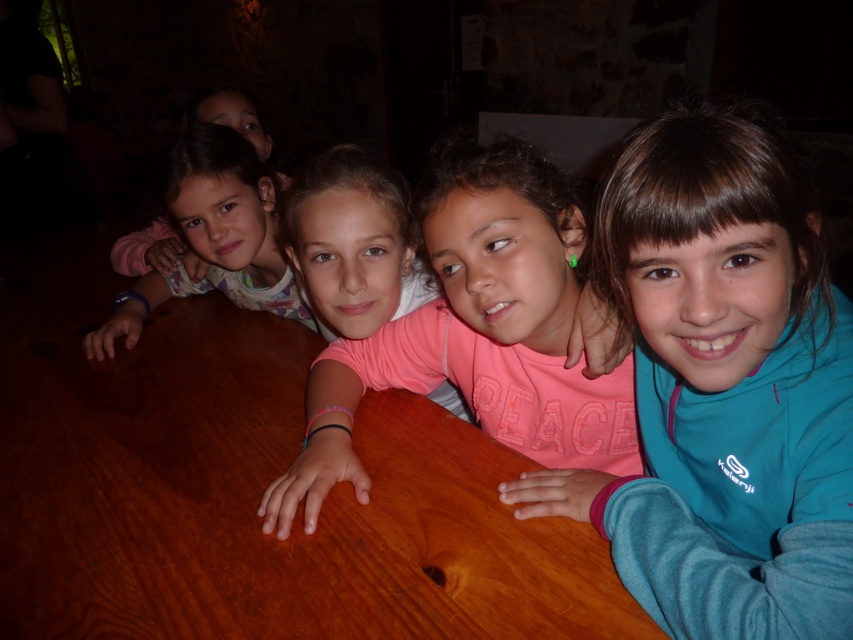
Does teal fleece jacket at center have a lesser width compared to matte pink shirt at upper left?

Indeed, teal fleece jacket at center has a lesser width compared to matte pink shirt at upper left.

Describe the element at coordinates (723, 388) in the screenshot. I see `teal fleece jacket at center` at that location.

You are a GUI agent. You are given a task and a screenshot of the screen. Output one action in this format:
    pyautogui.click(x=<x>, y=<y>)
    Task: Click on the teal fleece jacket at center
    
    Given the screenshot: What is the action you would take?
    pyautogui.click(x=723, y=388)

How distant is matte pink shirt at left from matte pink shirt at upper left?

The distance of matte pink shirt at left from matte pink shirt at upper left is 10.27 inches.

Between point (218, 266) and point (160, 260), which one is positioned behind?

The point (160, 260) is behind.

Where is `matte pink shirt at left`? matte pink shirt at left is located at coordinates (213, 236).

Can you confirm if wooden table at center is bigger than teal fleece jacket at center?

Correct, wooden table at center is larger in size than teal fleece jacket at center.

Is wooden table at center taller than teal fleece jacket at center?

In fact, wooden table at center may be shorter than teal fleece jacket at center.

Does point (163, 563) come behind point (837, 369)?

Yes, point (163, 563) is farther from viewer.

Locate an element on the screen. The height and width of the screenshot is (640, 853). wooden table at center is located at coordinates (254, 493).